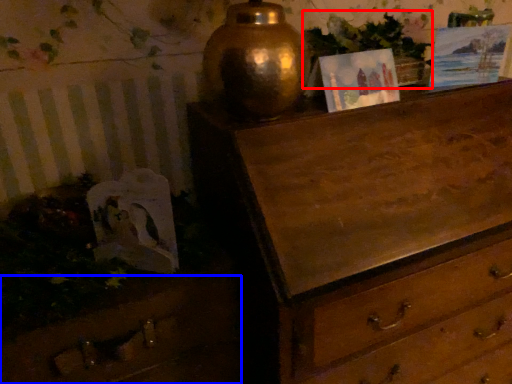
Question: Which of the following is the farthest to the observer, vegetation (highlighted by a red box) or drawer (highlighted by a blue box)?

Choices:
 (A) vegetation
 (B) drawer

Answer: (A)